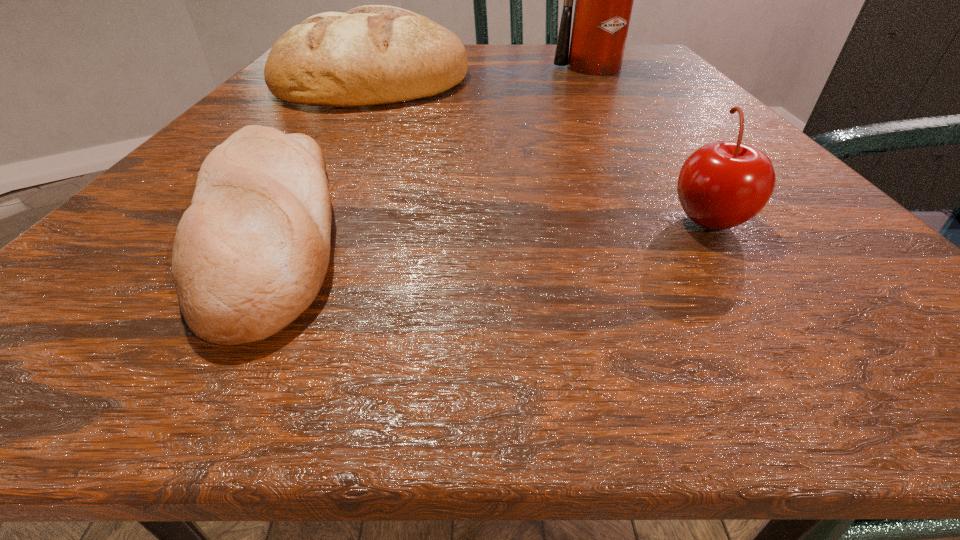
The height and width of the screenshot is (540, 960). In the image, there is a desktop. What are the coordinates of `free space at the near left corner` in the screenshot? It's located at (143, 357).

Where is `free region at the far right corner of the desktop`? free region at the far right corner of the desktop is located at coordinates (650, 69).

The image size is (960, 540). Find the location of `free spot between the shortest object and the cherry`. free spot between the shortest object and the cherry is located at coordinates (486, 223).

Identify the location of vacant area that lies between the fire extinguisher and the shorter bread. This screenshot has width=960, height=540. (431, 149).

Find the location of a particular element. The height and width of the screenshot is (540, 960). blank region between the farther bread and the fire extinguisher is located at coordinates (485, 73).

The height and width of the screenshot is (540, 960). What are the coordinates of `free space between the cherry and the tallest object` in the screenshot? It's located at (651, 144).

You are a GUI agent. You are given a task and a screenshot of the screen. Output one action in this format:
    pyautogui.click(x=<x>, y=<y>)
    Task: Click on the vacant point located between the cherry and the tallest object
    The width and height of the screenshot is (960, 540).
    Given the screenshot: What is the action you would take?
    pyautogui.click(x=651, y=144)

Locate an element on the screen. This screenshot has height=540, width=960. vacant space in between the cherry and the nearer bread is located at coordinates (486, 223).

The width and height of the screenshot is (960, 540). What are the coordinates of `vacant point located between the tallest object and the farther bread` in the screenshot? It's located at (485, 73).

Locate an element on the screen. vacant space that is in between the taller bread and the tallest object is located at coordinates (485, 73).